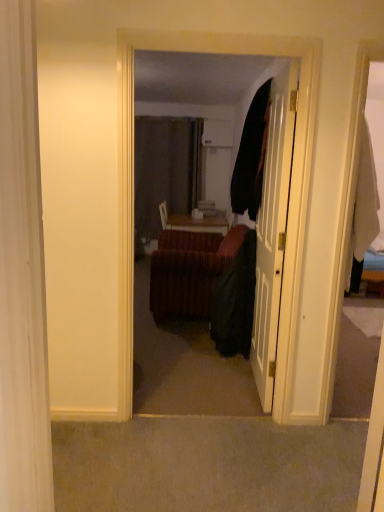
Find the location of a particular element. blank space above velvet couch at center (from a real-world perspective) is located at coordinates (211, 33).